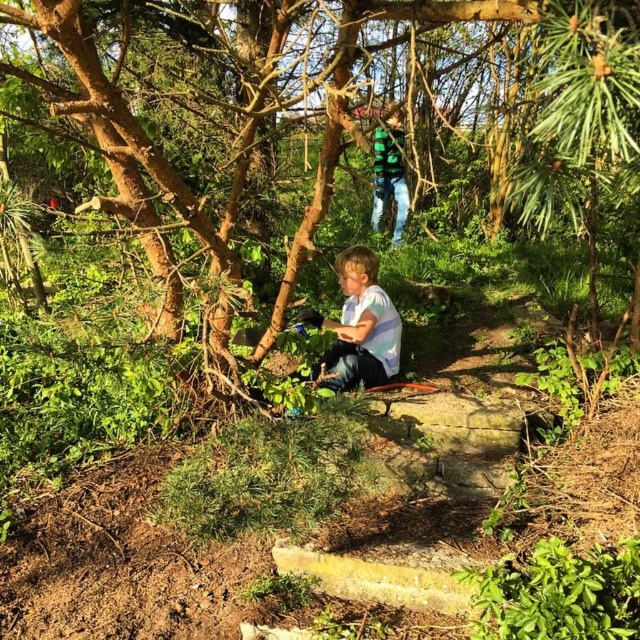
Question: Is the position of white striped shirt at center more distant than that of green striped shirt at upper center?

Choices:
 (A) yes
 (B) no

Answer: (B)

Question: Can you confirm if brown rough tree at center is positioned to the left of white striped shirt at center?

Choices:
 (A) yes
 (B) no

Answer: (A)

Question: Among these points, which one is farthest from the camera?

Choices:
 (A) (328, 44)
 (B) (381, 134)
 (C) (378, 362)

Answer: (B)

Question: Among these objects, which one is farthest from the camera?

Choices:
 (A) brown rough tree at center
 (B) green striped shirt at upper center

Answer: (B)

Question: Estimate the real-world distances between objects in this image. Which object is farther from the white striped shirt at center?

Choices:
 (A) brown rough tree at center
 (B) green striped shirt at upper center

Answer: (B)

Question: From the image, what is the correct spatial relationship of white striped shirt at center in relation to green striped shirt at upper center?

Choices:
 (A) left
 (B) right

Answer: (A)